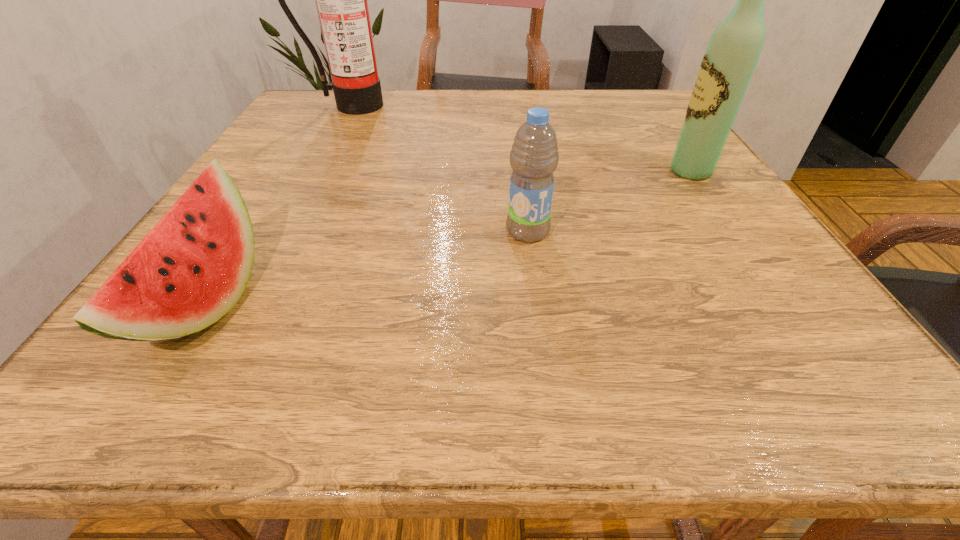
The height and width of the screenshot is (540, 960). I want to click on fire extinguisher, so click(x=341, y=0).

This screenshot has width=960, height=540. In order to click on the rightmost object in this screenshot , I will do `click(729, 61)`.

This screenshot has width=960, height=540. In order to click on wine bottle in this screenshot , I will do `click(729, 61)`.

Identify the location of the third tallest object. The height and width of the screenshot is (540, 960). (534, 156).

Locate an element on the screen. the second object from right to left is located at coordinates click(x=534, y=156).

At what (x,y) coordinates should I click in order to perform the action: click on the shortest object. Please return your answer as a coordinate pair (x, y). Image resolution: width=960 pixels, height=540 pixels. Looking at the image, I should click on (193, 266).

Identify the location of vacant space situated 0.300m on the front-facing side of the farthest object. The image size is (960, 540). (311, 175).

The height and width of the screenshot is (540, 960). I want to click on vacant region located 0.300m on the front-facing side of the rightmost object, so click(526, 171).

The height and width of the screenshot is (540, 960). In order to click on vacant space situated on the front-facing side of the rightmost object in this screenshot , I will do `click(478, 171)`.

You are a GUI agent. You are given a task and a screenshot of the screen. Output one action in this format:
    pyautogui.click(x=<x>, y=<y>)
    Task: Click on the free space located on the front-facing side of the rightmost object
    
    Given the screenshot: What is the action you would take?
    pyautogui.click(x=579, y=171)